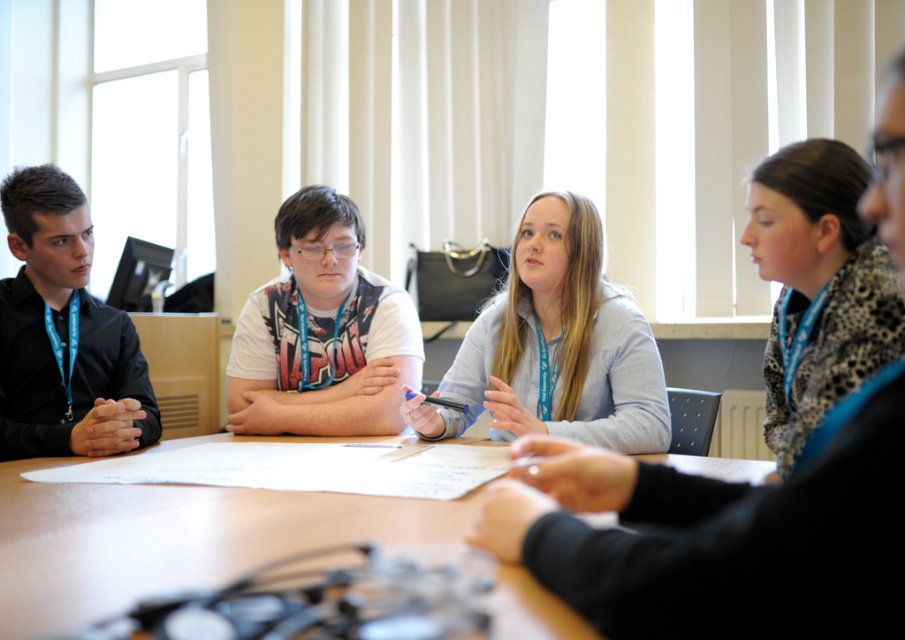
You are a photographer standing at the back of the room. You want to take a photo of the wooden table at center and the white matte shirt at center. Considering the distance between them, can you fit both subjects into the frame without moving your camera position?

The wooden table at center is only 43.08 centimeters away from the white matte shirt at center, so yes, both subjects can be captured in the same frame without needing to adjust the camera position.

From the picture: You are standing at the entrance of the room and want to approach the wooden table at center. There is a light blue shirt at center in your way. Can you walk directly to the table without going around the person?

The wooden table at center is in front of the light blue shirt at center, so you can walk directly to the wooden table at center without needing to go around the person wearing the light blue shirt at center.

You are a photographer setting up for a group photo. You need to position the light blue shirt at center and the white matte shirt at center so that both are clearly visible. Based on their current positions, which one should you adjust to ensure both are visible?

The light blue shirt at center is in front of the white matte shirt at center. To ensure both are visible, you should move the light blue shirt at center backward or the white matte shirt at center forward so they are not overlapping.